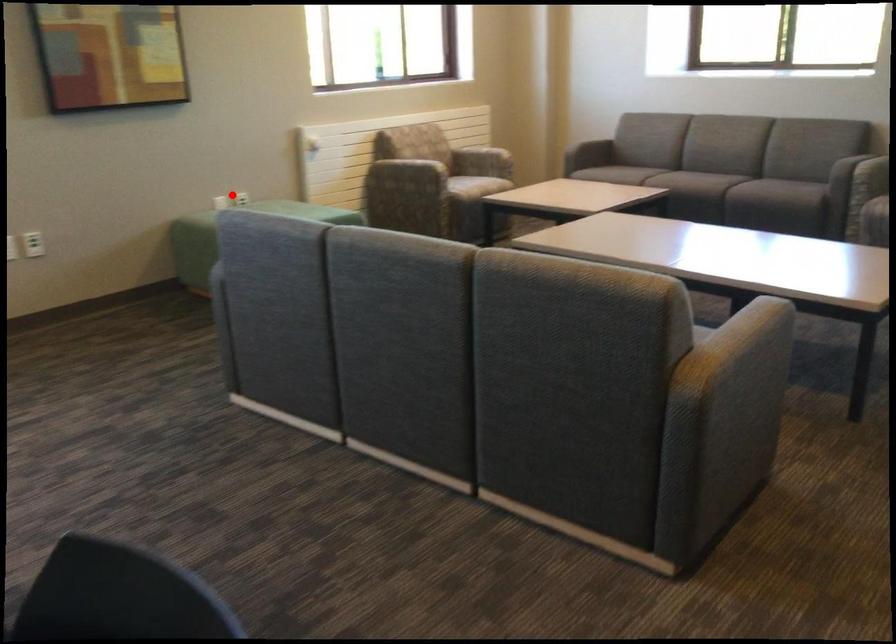
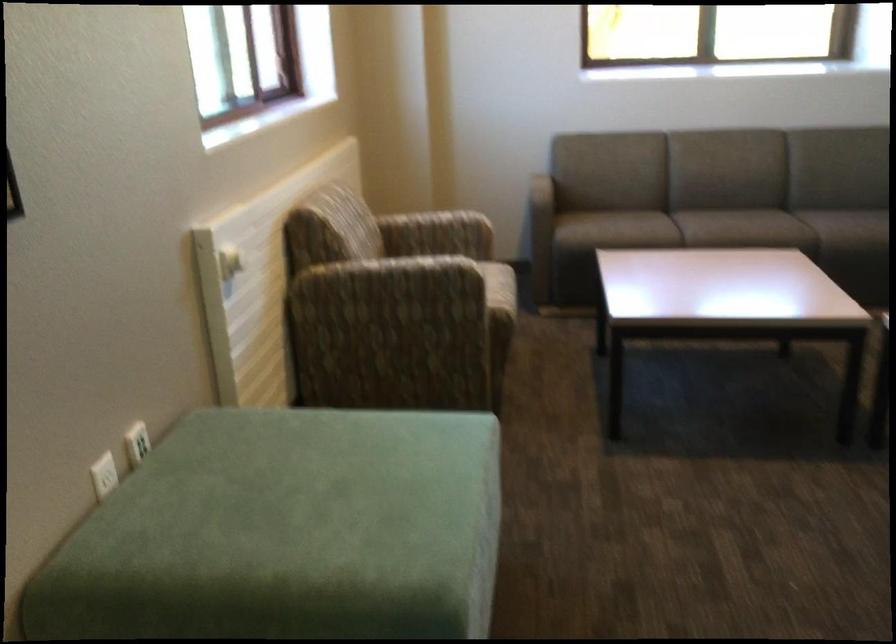
Locate, in the second image, the point that corresponds to the highlighted location in the first image.

(136, 442)